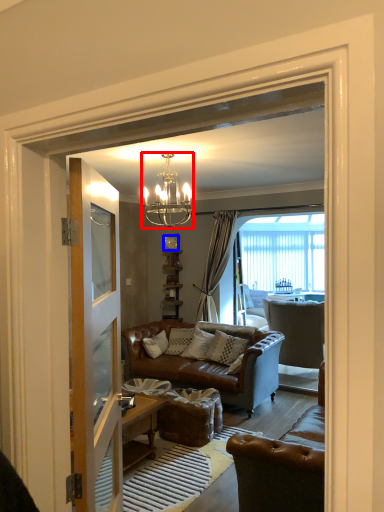
Question: Which point is closer to the camera, lamp (highlighted by a red box) or clock (highlighted by a blue box)?

Choices:
 (A) lamp
 (B) clock

Answer: (A)